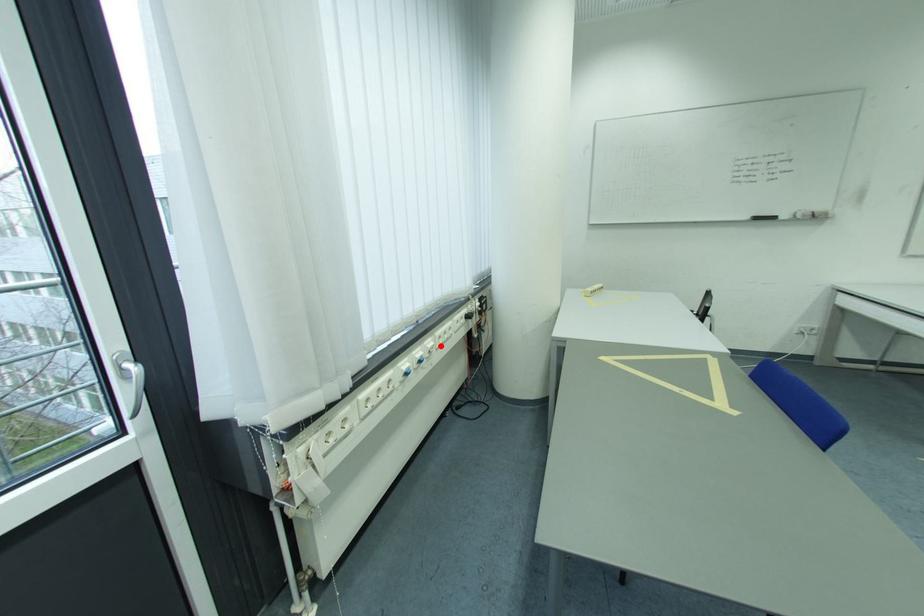
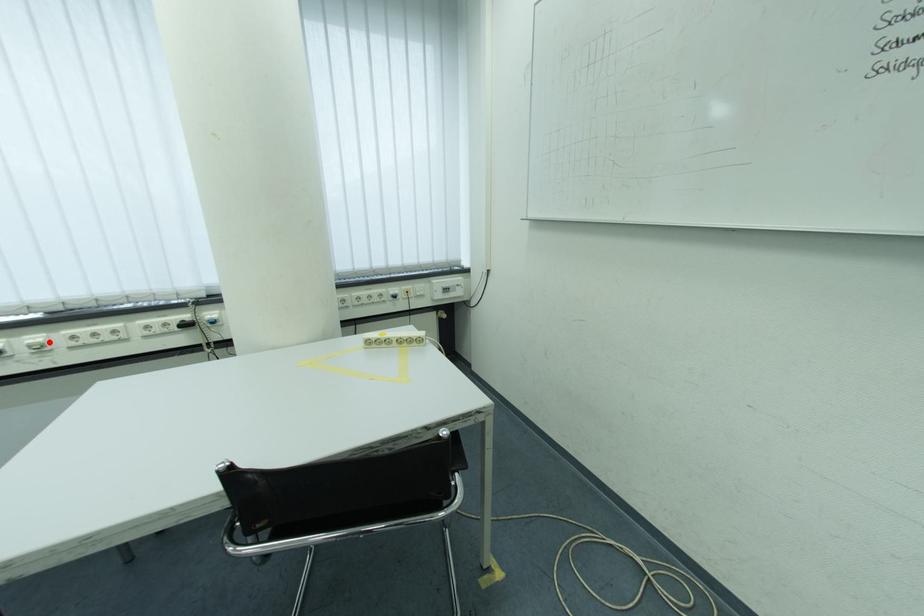
I am providing you with two images of the same scene from different viewpoints. A red point is marked on the first image and another point is marked on the second image. Does the point marked in image1 correspond to the same location as the one in image2?

Yes